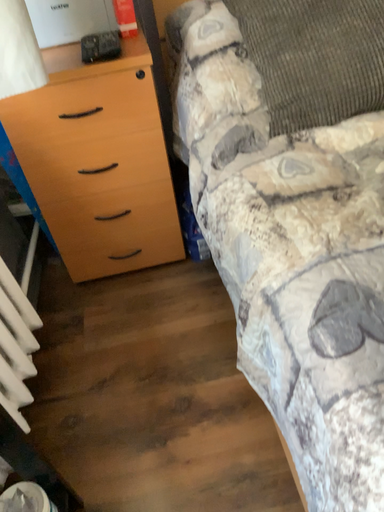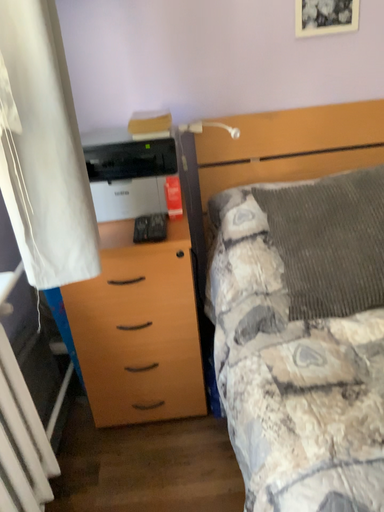
Question: Which way did the camera rotate in the video?

Choices:
 (A) rotated upward
 (B) rotated downward

Answer: (A)